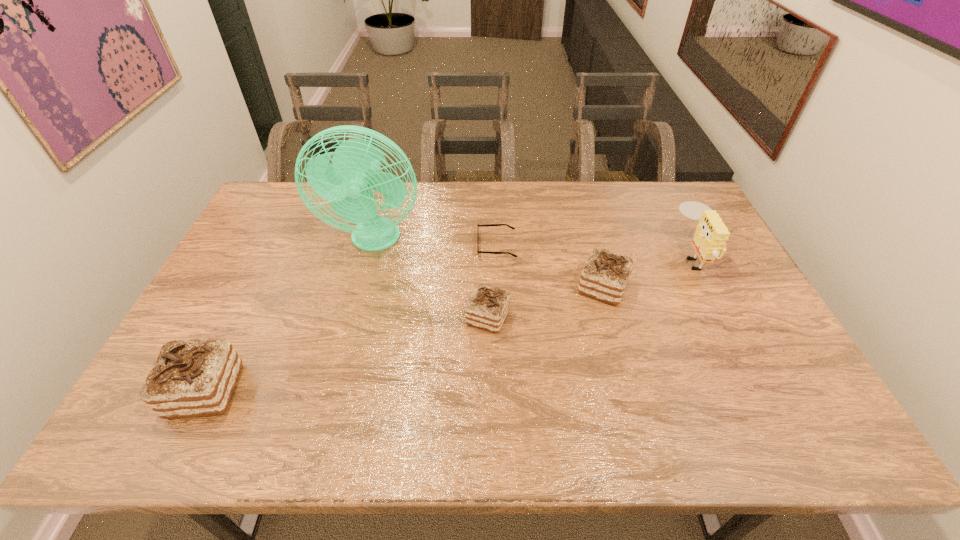
Where is `the rightmost object`? The width and height of the screenshot is (960, 540). the rightmost object is located at coordinates (711, 234).

The height and width of the screenshot is (540, 960). In order to click on vacant space situated on the right of the nearest object in this screenshot , I will do `click(260, 391)`.

I want to click on vacant space located 0.050m on the front of the fifth tallest object, so click(x=489, y=351).

You are a GUI agent. You are given a task and a screenshot of the screen. Output one action in this format:
    pyautogui.click(x=<x>, y=<y>)
    Task: Click on the blank space located on the left of the fifth object from left to right
    The image size is (960, 540).
    Given the screenshot: What is the action you would take?
    pyautogui.click(x=559, y=287)

Identify the location of free location located on the front-facing side of the shortest object. (452, 245).

Image resolution: width=960 pixels, height=540 pixels. What are the coordinates of `vacant region located on the front-facing side of the shortest object` in the screenshot? It's located at (381, 245).

The image size is (960, 540). What are the coordinates of `vacant space situated 0.390m on the front-facing side of the shortest object` in the screenshot? It's located at (356, 245).

Locate an element on the screen. This screenshot has height=540, width=960. free region located in front of the second object from left to right to blow air is located at coordinates (363, 288).

I want to click on vacant region located 0.400m on the front-facing side of the rightmost object, so click(548, 256).

Find the location of a particular element. The width and height of the screenshot is (960, 540). free space located 0.280m on the front-facing side of the rightmost object is located at coordinates (587, 256).